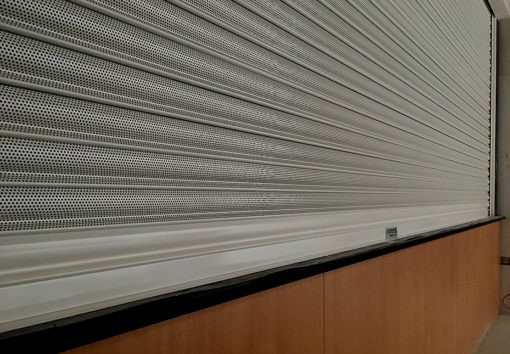
You are a GUI agent. You are given a task and a screenshot of the screen. Output one action in this format:
    pyautogui.click(x=<x>, y=<y>)
    Task: Click on the wall to the right of area
    The width and height of the screenshot is (510, 354).
    Given the screenshot: What is the action you would take?
    pyautogui.click(x=503, y=117)